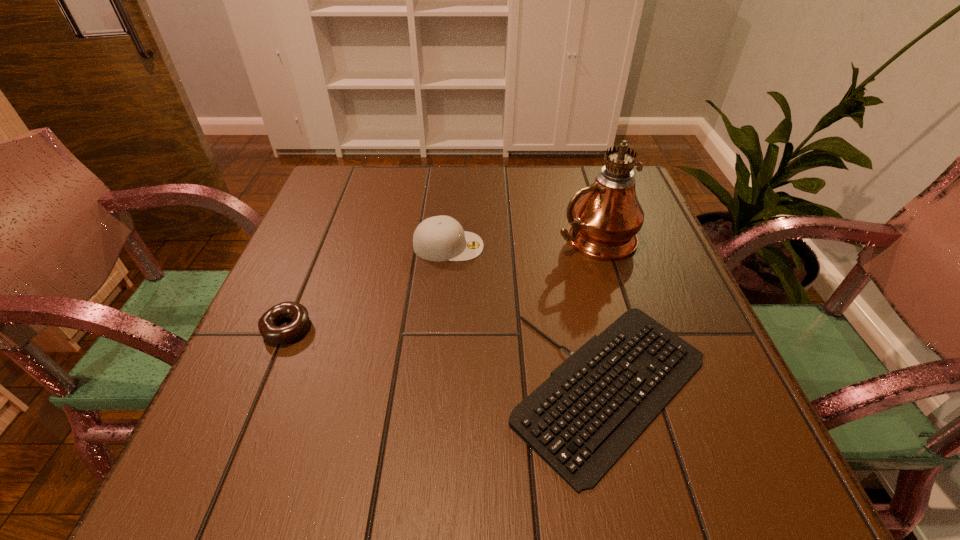
The width and height of the screenshot is (960, 540). I want to click on vacant area between the oil lamp and the computer keyboard, so click(x=604, y=314).

Identify the location of free space between the shortest object and the third shortest object. This screenshot has height=540, width=960. (531, 318).

Identify the location of vacant region between the computer keyboard and the oil lamp. pyautogui.click(x=604, y=314).

Where is `free point between the doughnut and the second object from left to right`? This screenshot has height=540, width=960. free point between the doughnut and the second object from left to right is located at coordinates (368, 287).

Where is `free space between the oil lamp and the leftmost object`? This screenshot has height=540, width=960. free space between the oil lamp and the leftmost object is located at coordinates (441, 284).

Find the location of a particular element. free point between the computer keyboard and the second shortest object is located at coordinates (449, 359).

Identify the location of free area in between the oil lamp and the cap. The image size is (960, 540). (521, 242).

Where is `empty space between the shortest object and the doughnut`? empty space between the shortest object and the doughnut is located at coordinates (449, 359).

Where is `vacant area that lies between the cap and the computer keyboard`? This screenshot has width=960, height=540. vacant area that lies between the cap and the computer keyboard is located at coordinates (531, 318).

What are the coordinates of `vacant area that lies between the cap and the shortest object` in the screenshot? It's located at (531, 318).